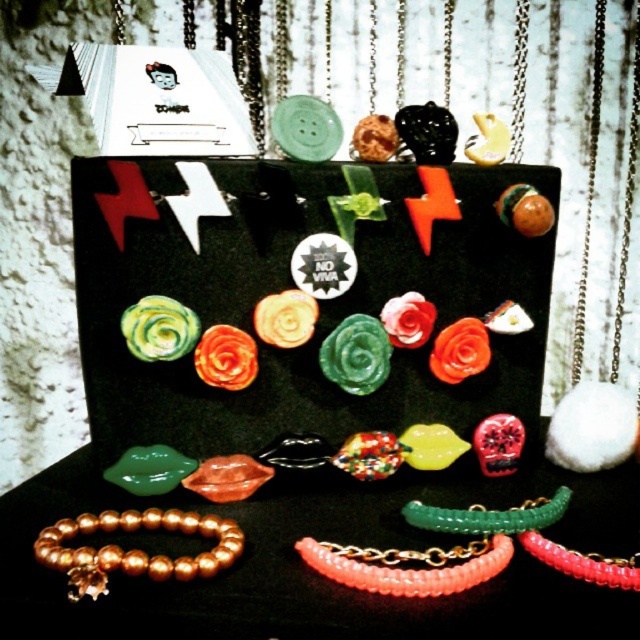
Question: Which point is farther to the camera?

Choices:
 (A) (179, 560)
 (B) (468, 564)
 (C) (468, 513)
 (D) (545, 547)

Answer: (C)

Question: Is the position of pink beaded bracelet at center more distant than that of translucent coral beads at lower right?

Choices:
 (A) yes
 (B) no

Answer: (B)

Question: Is green glass bracelet at center smaller than translucent coral beads at lower right?

Choices:
 (A) no
 (B) yes

Answer: (A)

Question: Which of the following is the closest to the observer?

Choices:
 (A) (234, 536)
 (B) (632, 557)
 (C) (504, 544)

Answer: (B)

Question: Can you confirm if gold pearl bracelet at lower left is bigger than pink beaded bracelet at center?

Choices:
 (A) yes
 (B) no

Answer: (A)

Question: Among these objects, which one is farthest from the camera?

Choices:
 (A) pink beaded bracelet at center
 (B) translucent coral beads at lower right
 (C) gold pearl bracelet at lower left
 (D) green glass bracelet at center

Answer: (D)